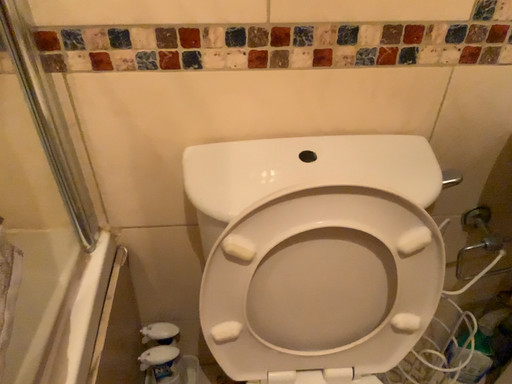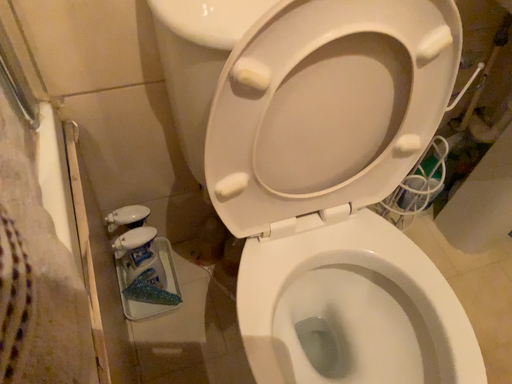
Question: How did the camera likely rotate when shooting the video?

Choices:
 (A) rotated downward
 (B) rotated upward

Answer: (A)